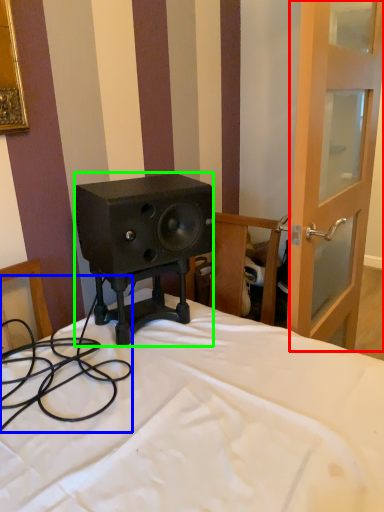
Question: Considering the real-world distances, which object is farthest from screen door (highlighted by a red box)? cable (highlighted by a blue box) or loudspeaker (highlighted by a green box)?

Choices:
 (A) cable
 (B) loudspeaker

Answer: (A)